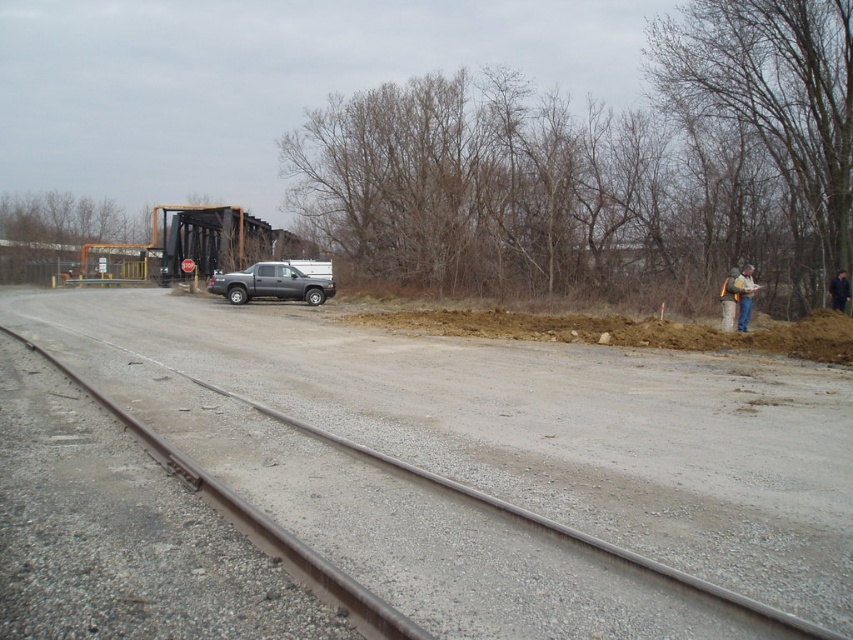
Who is higher up, rusty metal track at center or gray metallic truck at center?

Positioned higher is gray metallic truck at center.

Does rusty metal track at center appear on the right side of gray metallic truck at center?

Yes, rusty metal track at center is to the right of gray metallic truck at center.

Between point (763, 618) and point (302, 298), which one is positioned behind?

Positioned behind is point (302, 298).

Image resolution: width=853 pixels, height=640 pixels. In order to click on rusty metal track at center in this screenshot , I will do `click(492, 502)`.

Between gray metallic truck at center and blue jeans at right, which one appears on the right side from the viewer's perspective?

Positioned to the right is blue jeans at right.

Does gray metallic truck at center have a smaller size compared to blue jeans at right?

No.

Where is `gray metallic truck at center`? This screenshot has height=640, width=853. gray metallic truck at center is located at coordinates (271, 284).

Does rusty metal track at center appear over blue jeans at right?

No.

Which is behind, point (387, 611) or point (740, 308)?

Positioned behind is point (740, 308).

I want to click on rusty metal track at center, so click(492, 502).